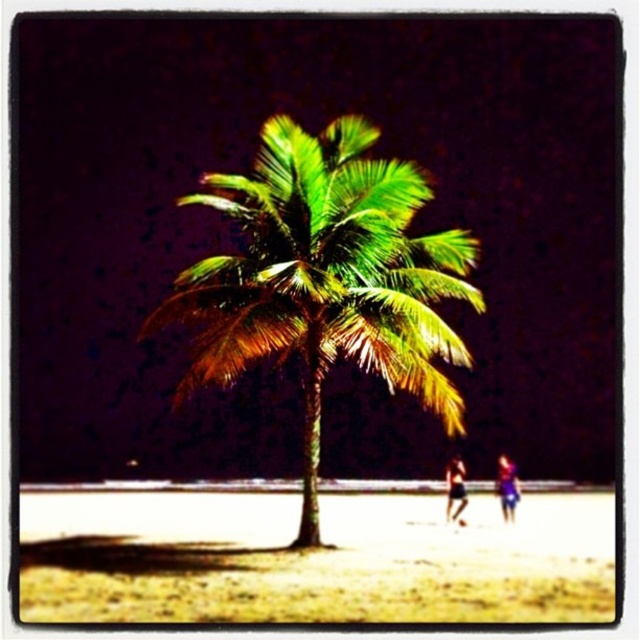
Can you confirm if green leafy palm at center is positioned to the left of blue fabric at lower right?

Correct, you'll find green leafy palm at center to the left of blue fabric at lower right.

Is green leafy palm at center wider than blue fabric at lower right?

In fact, green leafy palm at center might be narrower than blue fabric at lower right.

Between point (404, 237) and point (506, 467), which one is positioned in front?

Point (404, 237)

Identify the location of green leafy palm at center. This screenshot has width=640, height=640. (324, 276).

Is beige sandy beach at center closer to camera compared to green leafy palm at center?

No, it is behind green leafy palm at center.

Can you confirm if beige sandy beach at center is smaller than green leafy palm at center?

No.

Does point (40, 500) lie in front of point (257, 193)?

No, it is behind (257, 193).

This screenshot has height=640, width=640. Identify the location of beige sandy beach at center. (312, 560).

Is green leafy palm at center to the right of dark blue fabric shorts at lower right from the viewer's perspective?

Incorrect, green leafy palm at center is not on the right side of dark blue fabric shorts at lower right.

Which is below, green leafy palm at center or dark blue fabric shorts at lower right?

dark blue fabric shorts at lower right is lower down.

Who is more forward, (314, 416) or (449, 504)?

Point (314, 416) is more forward.

Where is `green leafy palm at center`? This screenshot has height=640, width=640. green leafy palm at center is located at coordinates (324, 276).